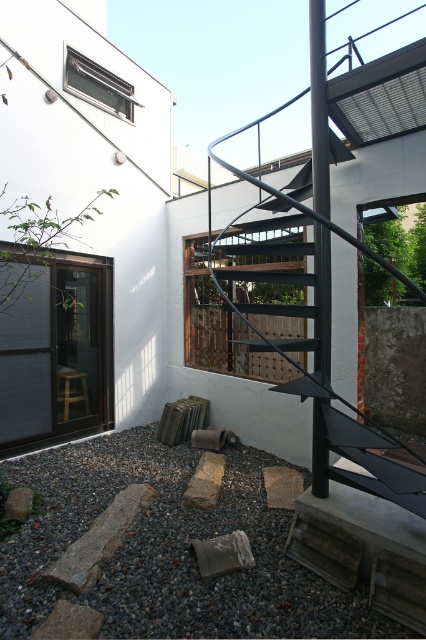
You are an interior designer planning to place a wide sofa in the area. The sofa is 1.8 meters wide. You see the matte black glass door at left and the gray rough stone at center. Which object has a wider width, and can the sofa fit next to it?

The matte black glass door at left has a wider width than the gray rough stone at center. Since the sofa is 1.8 meters wide, it can fit next to the matte black glass door at left if there is sufficient space available.

You are standing in the modern architectural space depicted in the scene. You need to approach the black matte staircase at center. Given that the average walking distance for an adult is about 8 feet, will you be able to reach the staircase without needing to adjust your path?

The black matte staircase at center is 8.26 feet away from the viewer. Since the average walking distance for an adult is about 8 feet, the staircase is slightly farther than the average, so you might need to take a few extra steps or adjust your path slightly to reach it.

You are standing in the modern architectural space described. You need to place a small potted plant on the gray rough stone at center. However, there is a matte black glass door at left nearby. Based on their positions, can you determine if the door is higher or lower than the stone?

The matte black glass door at left is above the gray rough stone at center, so the door is higher than the stone.